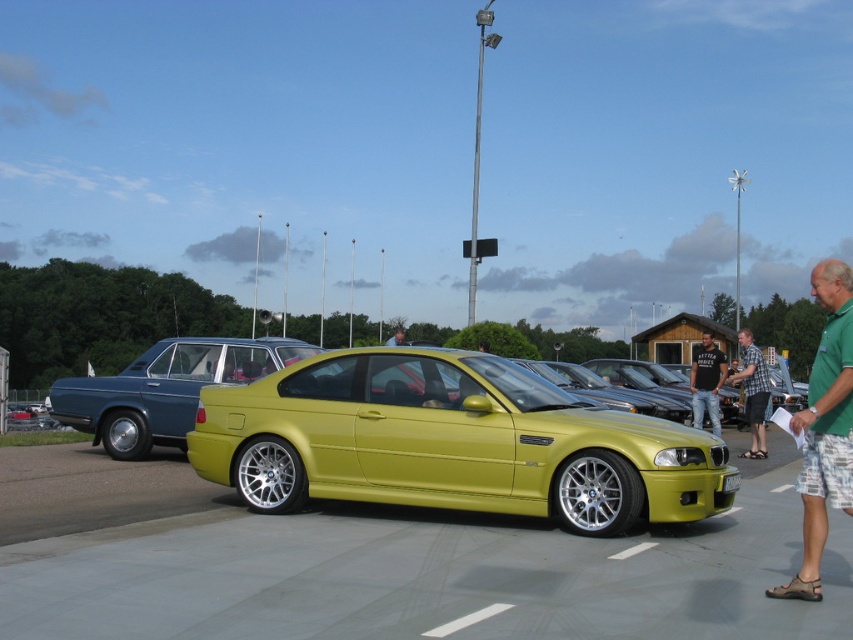
Is green fabric shirt at right shorter than plaid shirt at center?

No, green fabric shirt at right is not shorter than plaid shirt at center.

Is green fabric shirt at right thinner than plaid shirt at center?

In fact, green fabric shirt at right might be wider than plaid shirt at center.

Where is `green fabric shirt at right`? This screenshot has width=853, height=640. green fabric shirt at right is located at coordinates coord(824,428).

Is point (114, 442) positioned before point (699, 397)?

Yes, point (114, 442) is closer to viewer.

Can you confirm if metallic blue sedan at left is positioned below black cotton shirt at center?

No, metallic blue sedan at left is not below black cotton shirt at center.

Between point (281, 356) and point (701, 424), which one is positioned in front?

Point (281, 356) is more forward.

Locate an element on the screen. This screenshot has height=640, width=853. metallic blue sedan at left is located at coordinates (164, 388).

Is green fabric shirt at right smaller than matte black car at center?

Yes.

You are a GUI agent. You are given a task and a screenshot of the screen. Output one action in this format:
    pyautogui.click(x=<x>, y=<y>)
    Task: Click on the green fabric shirt at right
    The width and height of the screenshot is (853, 640).
    Given the screenshot: What is the action you would take?
    pyautogui.click(x=824, y=428)

Who is more forward, (810, 412) or (402, 337)?

Point (810, 412) is in front.

At what (x,y) coordinates should I click in order to perform the action: click on green fabric shirt at right. Please return your answer as a coordinate pair (x, y). Looking at the image, I should click on (824, 428).